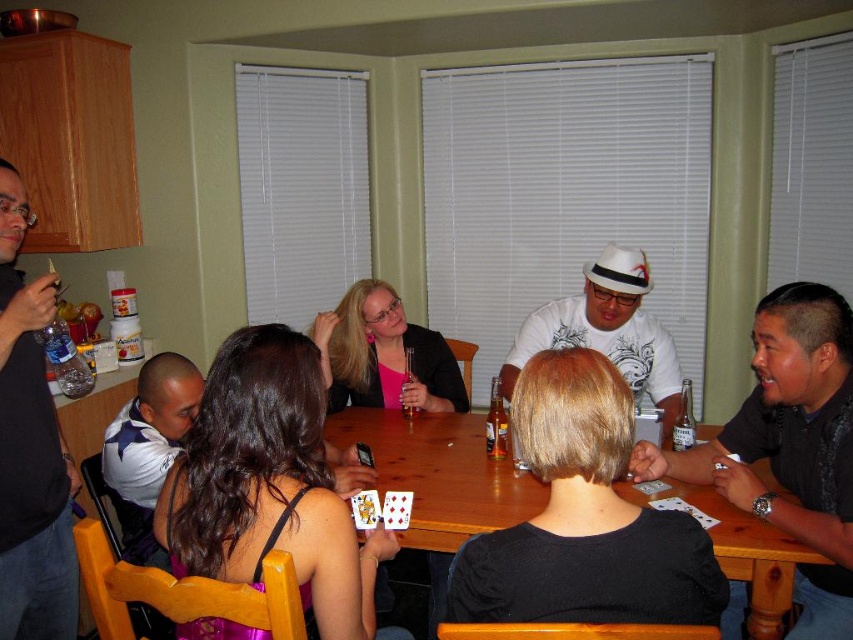
Question: Considering the real-world distances, which object is closest to the wooden table at center?

Choices:
 (A) brown glass bottle at table center
 (B) black matte shirt at left
 (C) translucent glass bottle at table center

Answer: (C)

Question: Which object appears farthest from the camera in this image?

Choices:
 (A) brown glass bottle at table center
 (B) wooden table at center

Answer: (A)

Question: In this image, where is wooden table at center located relative to black matte shirt at left?

Choices:
 (A) above
 (B) below

Answer: (B)

Question: Is black shirt at right positioned before translucent glass bottle at table center?

Choices:
 (A) no
 (B) yes

Answer: (B)

Question: Is wooden table at center closer to the viewer compared to brown glass bottle at table center?

Choices:
 (A) no
 (B) yes

Answer: (B)

Question: Which point is farther to the camera?

Choices:
 (A) wooden table at center
 (B) white shirt at left

Answer: (B)